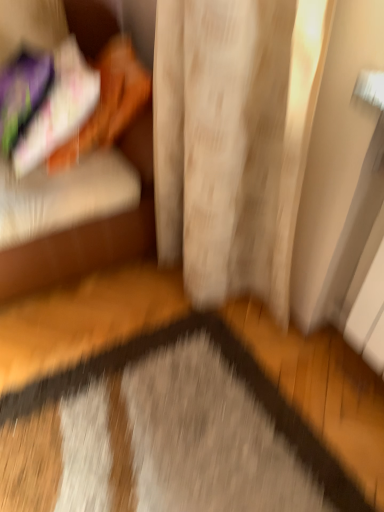
Image resolution: width=384 pixels, height=512 pixels. What are the coordinates of `vacant space situated above gray textured mat at center (from a real-world perspective)` in the screenshot? It's located at (172, 388).